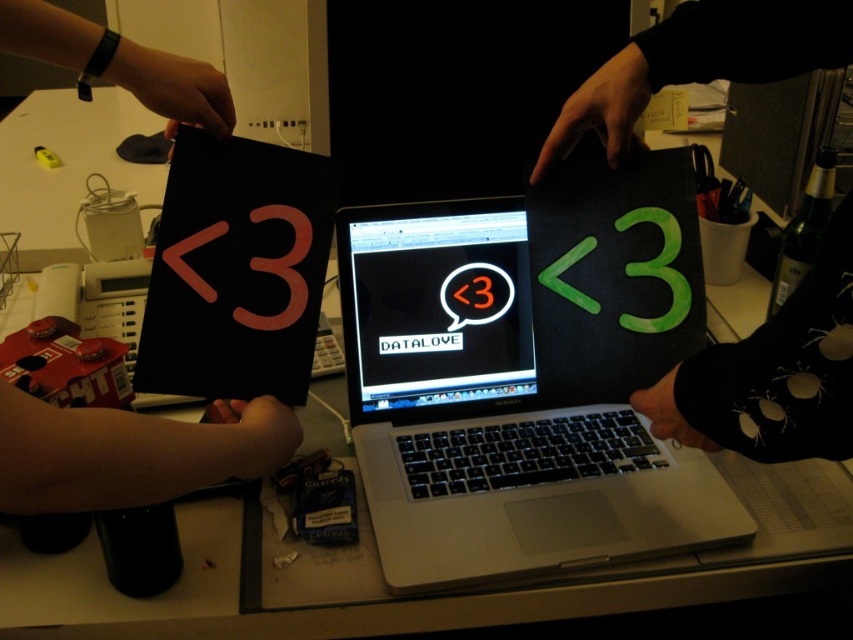
Who is lower down, green matte paper at center or matte black sign at left?

matte black sign at left is lower down.

Does point (761, 444) lie in front of point (19, 401)?

That is False.

This screenshot has height=640, width=853. I want to click on green matte paper at center, so click(773, 372).

Does black glossy laptop at center have a lesser width compared to matte black sign at left?

Incorrect, black glossy laptop at center's width is not less than matte black sign at left's.

From the picture: Which is above, black glossy laptop at center or matte black sign at left?

black glossy laptop at center is above.

Image resolution: width=853 pixels, height=640 pixels. Identify the location of black glossy laptop at center. (434, 307).

The image size is (853, 640). I want to click on black glossy laptop at center, so click(434, 307).

Can you confirm if green matte paper at center is wider than black matte screen at center?

No.

Which is behind, point (712, 35) or point (505, 22)?

Point (505, 22)

The width and height of the screenshot is (853, 640). Find the location of `green matte paper at center`. green matte paper at center is located at coordinates (773, 372).